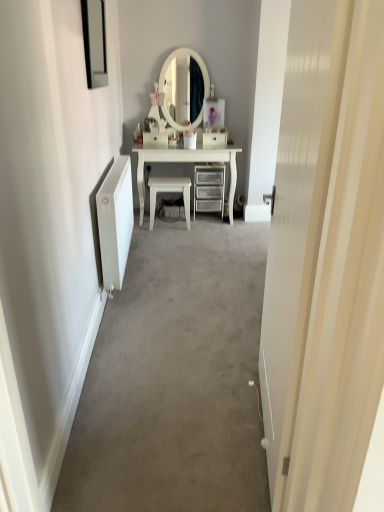
Where is `free space behind white wood door at center`? free space behind white wood door at center is located at coordinates (219, 365).